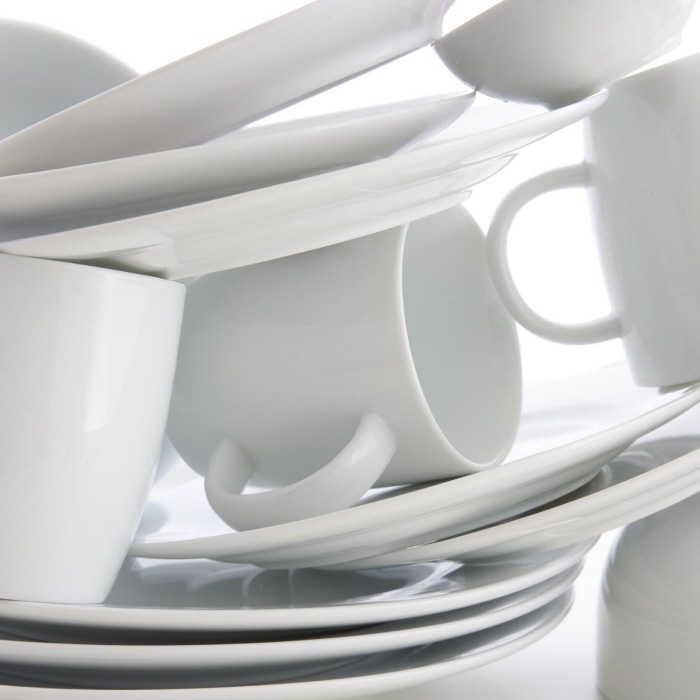
This screenshot has width=700, height=700. I want to click on plates, so click(337, 612), click(343, 650), click(353, 687), click(533, 528), click(477, 481), click(326, 195), click(287, 153), click(220, 85).